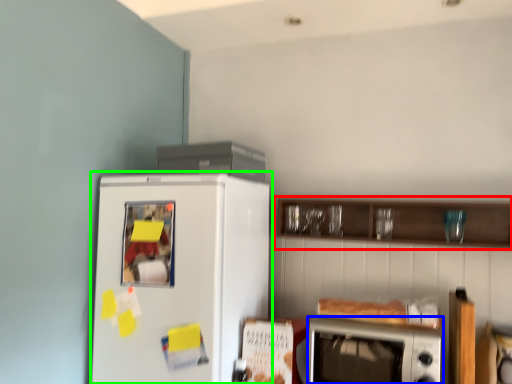
Question: Which is farther away from cabinetry (highlighted by a red box)? microwave oven (highlighted by a blue box) or refrigerator (highlighted by a green box)?

Choices:
 (A) microwave oven
 (B) refrigerator

Answer: (B)